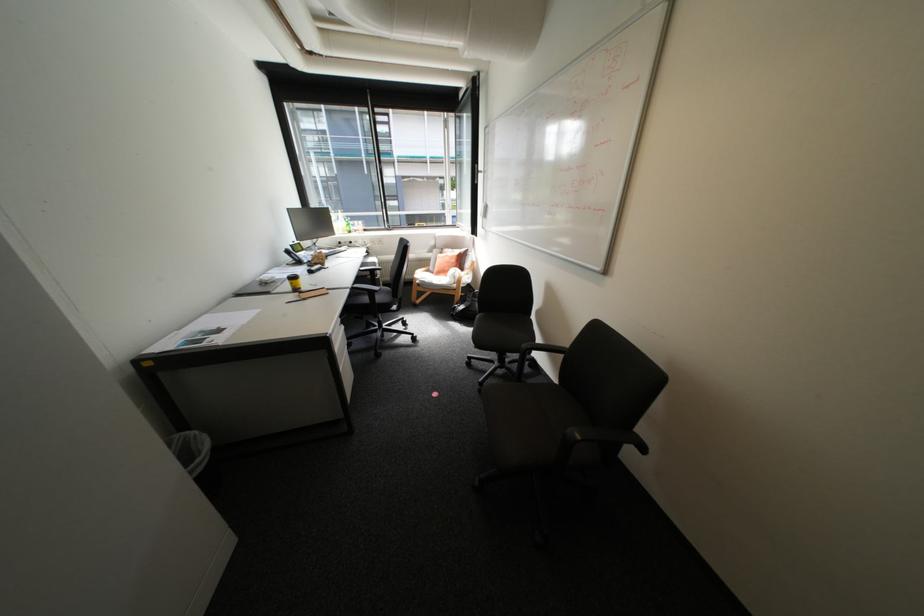
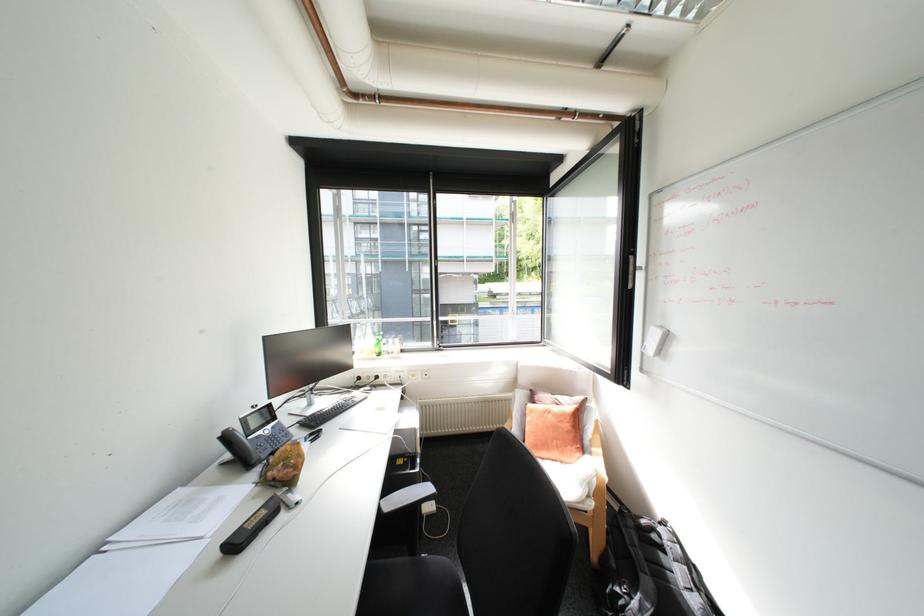
Locate, in the second image, the point that corresponds to point 468,306 in the first image.

(640, 598)